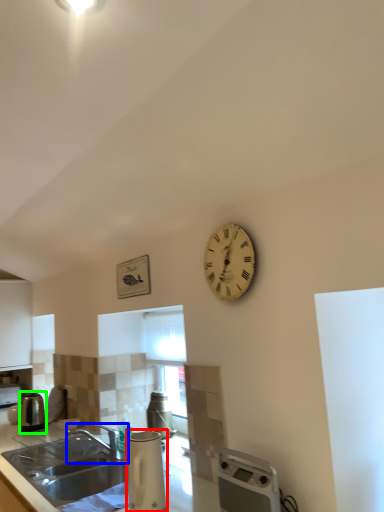
Question: Considering the real-world distances, which object is closest to appliance (highlighted by a red box)? tap (highlighted by a blue box) or kitchen appliance (highlighted by a green box).

Choices:
 (A) tap
 (B) kitchen appliance

Answer: (A)